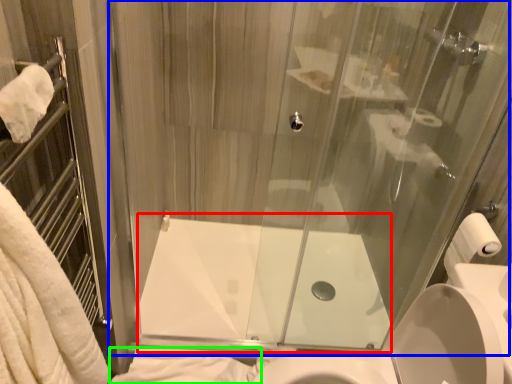
Question: Which object is the closest to the bath (highlighted by a red box)? Choose among these: glass door (highlighted by a blue box) or bath towel (highlighted by a green box).

Choices:
 (A) glass door
 (B) bath towel

Answer: (B)